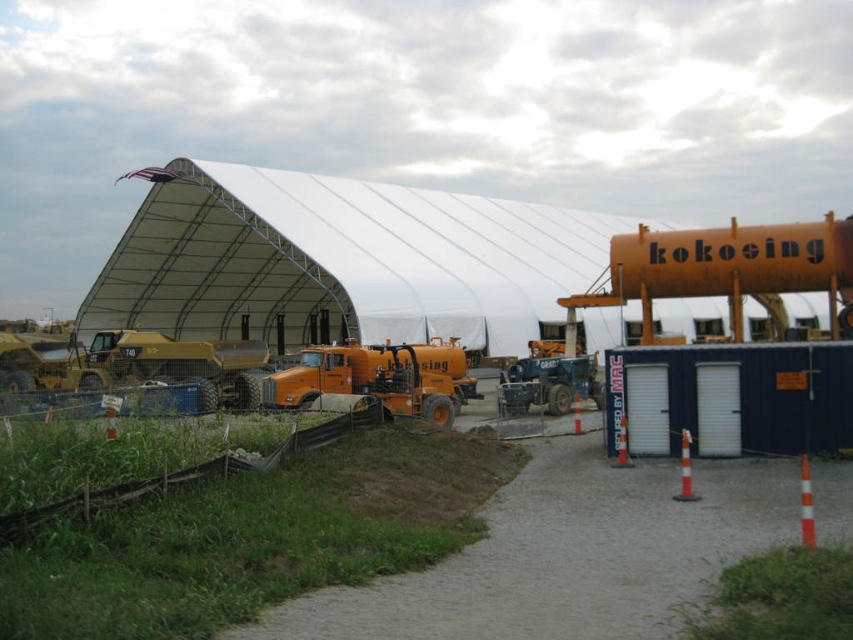
Which of these two, orange matte trailer truck at center or matte blue trailer truck at center, stands taller?

Standing taller between the two is orange matte trailer truck at center.

Which is behind, point (386, 349) or point (503, 410)?

Point (386, 349)

Identify the location of orange matte trailer truck at center. This screenshot has height=640, width=853. (376, 378).

Who is more forward, (373, 241) or (573, 362)?

Point (573, 362) is in front.

Does white fabric hangar at center have a greater height compared to matte blue trailer truck at center?

Yes, white fabric hangar at center is taller than matte blue trailer truck at center.

Does point (247, 177) come closer to viewer compared to point (589, 380)?

That is False.

The width and height of the screenshot is (853, 640). Find the location of `white fabric hangar at center`. white fabric hangar at center is located at coordinates (341, 260).

Between white fabric hangar at center and orange matte trailer truck at center, which one appears on the right side from the viewer's perspective?

white fabric hangar at center

Between white fabric hangar at center and orange matte trailer truck at center, which one is positioned lower?

Positioned lower is orange matte trailer truck at center.

Is point (91, 312) positioned in front of point (416, 372)?

No, it is behind (416, 372).

Find the location of a particular element. Image resolution: width=853 pixels, height=640 pixels. white fabric hangar at center is located at coordinates (341, 260).